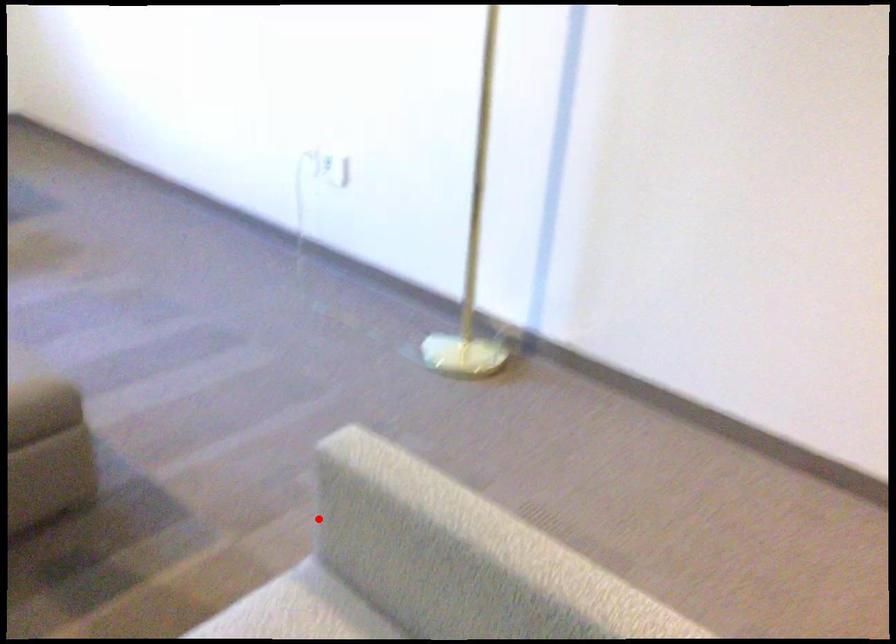
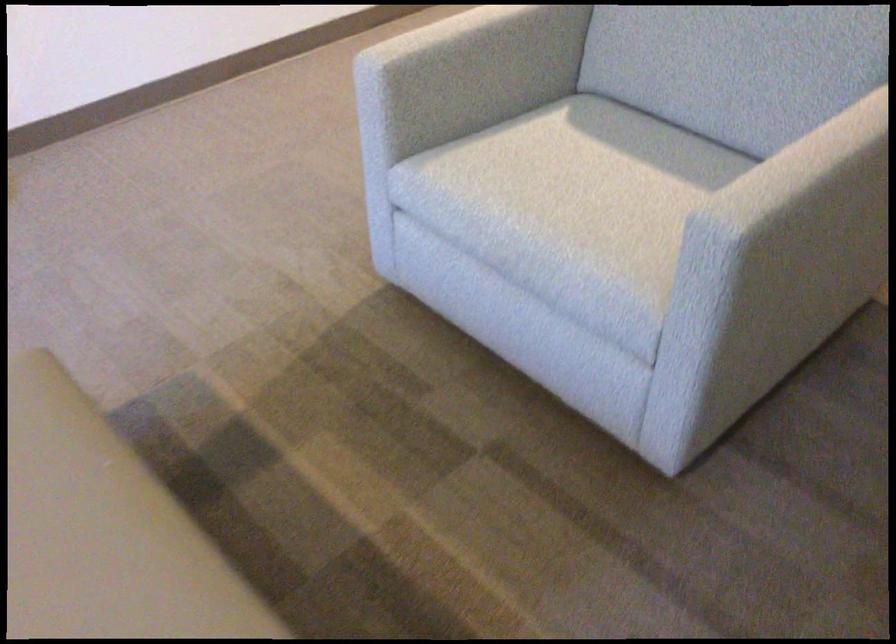
Question: I am providing you with two images of the same scene from different viewpoints. A red point is shown in image1. For the corresponding object point in image2, is it positioned nearer or farther from the camera?

Choices:
 (A) Nearer
 (B) Farther

Answer: (B)